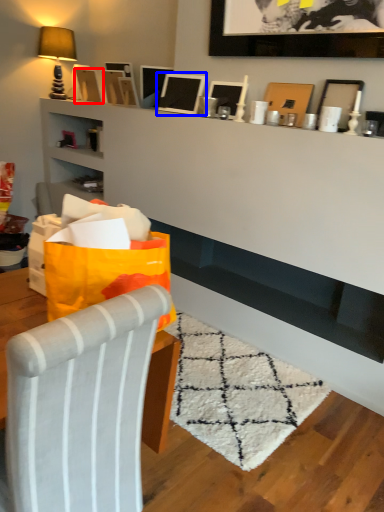
Question: Among these objects, which one is farthest to the camera, picture frame (highlighted by a red box) or picture frame (highlighted by a blue box)?

Choices:
 (A) picture frame
 (B) picture frame

Answer: (A)